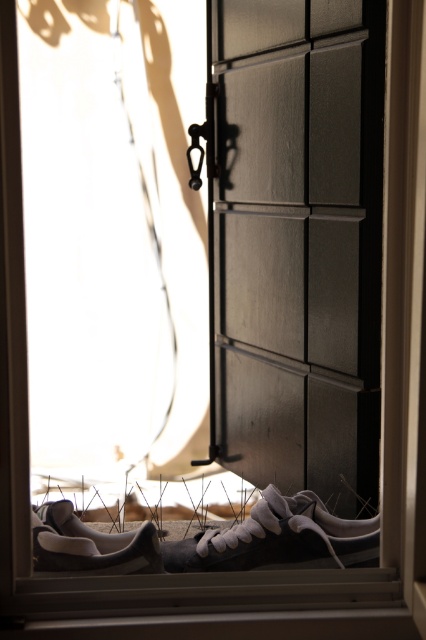
Question: Is suede/leather sneaker at lower center smaller than white suede shoe at lower left?

Choices:
 (A) no
 (B) yes

Answer: (A)

Question: Is matte black door at center to the left of white suede shoe at lower left from the viewer's perspective?

Choices:
 (A) yes
 (B) no

Answer: (B)

Question: Which point is closer to the camera taking this photo?

Choices:
 (A) (281, 179)
 (B) (218, 563)
 (C) (55, 540)

Answer: (C)

Question: Which point is closer to the camera?

Choices:
 (A) matte black door at center
 (B) white suede shoe at lower left
 (C) suede/leather sneaker at lower center

Answer: (B)

Question: Which of the following is the closest to the observer?

Choices:
 (A) (198, 547)
 (B) (253, 426)

Answer: (A)

Question: Is matte black door at center to the left of white suede shoe at lower left from the viewer's perspective?

Choices:
 (A) yes
 (B) no

Answer: (B)